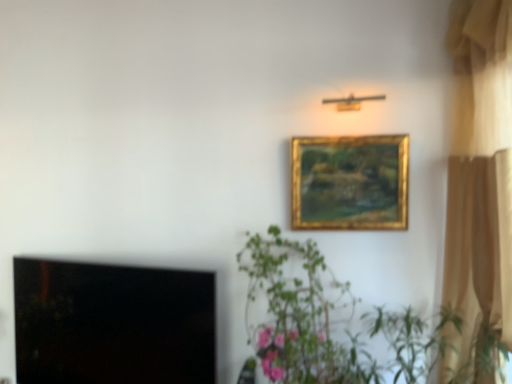
Question: Considering the relative sizes of gold/gilded picture frame at upper center and black glass window screen at lower left in the image provided, is gold/gilded picture frame at upper center thinner than black glass window screen at lower left?

Choices:
 (A) yes
 (B) no

Answer: (A)

Question: From the image's perspective, does gold/gilded picture frame at upper center appear higher than black glass window screen at lower left?

Choices:
 (A) yes
 (B) no

Answer: (A)

Question: Is gold/gilded picture frame at upper center smaller than black glass window screen at lower left?

Choices:
 (A) yes
 (B) no

Answer: (A)

Question: From a real-world perspective, is gold/gilded picture frame at upper center physically above black glass window screen at lower left?

Choices:
 (A) no
 (B) yes

Answer: (B)

Question: Is gold/gilded picture frame at upper center to the left of black glass window screen at lower left from the viewer's perspective?

Choices:
 (A) no
 (B) yes

Answer: (A)

Question: In terms of size, does black glass window screen at lower left appear bigger or smaller than green leafy plant at center?

Choices:
 (A) big
 (B) small

Answer: (B)

Question: From a real-world perspective, relative to green leafy plant at center, is black glass window screen at lower left vertically above or below?

Choices:
 (A) below
 (B) above

Answer: (A)

Question: In terms of width, does black glass window screen at lower left look wider or thinner when compared to green leafy plant at center?

Choices:
 (A) thin
 (B) wide

Answer: (A)

Question: Is point (20, 319) closer or farther from the camera than point (278, 365)?

Choices:
 (A) farther
 (B) closer

Answer: (A)

Question: From the image's perspective, is gold/gilded picture frame at upper center positioned above or below green leafy plant at center?

Choices:
 (A) below
 (B) above

Answer: (B)

Question: Is gold/gilded picture frame at upper center bigger or smaller than green leafy plant at center?

Choices:
 (A) small
 (B) big

Answer: (A)

Question: In terms of height, does gold/gilded picture frame at upper center look taller or shorter compared to green leafy plant at center?

Choices:
 (A) tall
 (B) short

Answer: (B)

Question: Do you think gold/gilded picture frame at upper center is within green leafy plant at center, or outside of it?

Choices:
 (A) inside
 (B) outside

Answer: (B)

Question: Looking at the image, does beige fabric curtain at right seem bigger or smaller compared to green leafy plant at center?

Choices:
 (A) big
 (B) small

Answer: (A)

Question: Looking at their shapes, would you say beige fabric curtain at right is wider or thinner than green leafy plant at center?

Choices:
 (A) thin
 (B) wide

Answer: (A)